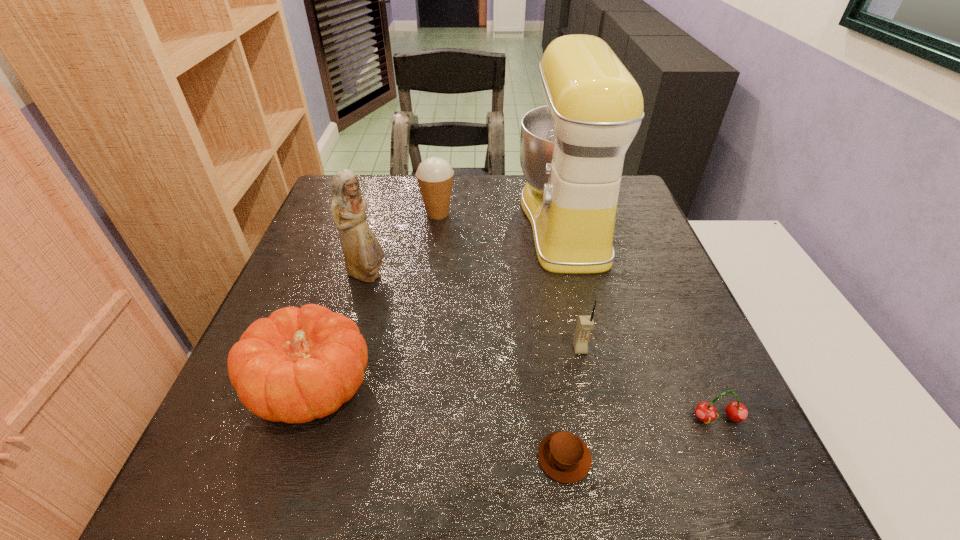
I want to click on vacant space located 0.400m on the side of the mixer with the control knob, so click(x=371, y=222).

Find the location of `free space located 0.230m on the front-facing side of the figurine`. free space located 0.230m on the front-facing side of the figurine is located at coordinates (486, 275).

Where is `vacant area situated 0.160m on the back of the icecream`? vacant area situated 0.160m on the back of the icecream is located at coordinates (443, 176).

What are the coordinates of `vacant space located 0.350m on the back of the pumpkin` in the screenshot? It's located at (362, 237).

The height and width of the screenshot is (540, 960). Identify the location of vacant space located 0.090m on the front of the cellular telephone, where the keypad is located. (589, 395).

Where is `free space located 0.060m with stems pointing upwards on the rightmost object`? This screenshot has width=960, height=540. free space located 0.060m with stems pointing upwards on the rightmost object is located at coordinates (737, 463).

You are a GUI agent. You are given a task and a screenshot of the screen. Output one action in this format:
    pyautogui.click(x=<x>, y=<y>)
    Task: Click on the free space located 0.210m on the left of the shortest object
    This screenshot has height=540, width=960.
    Given the screenshot: What is the action you would take?
    pyautogui.click(x=407, y=458)

In order to click on mixer that is positioned at the far edge in this screenshot , I will do `click(572, 151)`.

Locate an element on the screen. This screenshot has height=540, width=960. icecream that is positioned at the far edge is located at coordinates (434, 175).

Find the location of a particular element. Image resolution: width=960 pixels, height=540 pixels. object at the near edge is located at coordinates (563, 456).